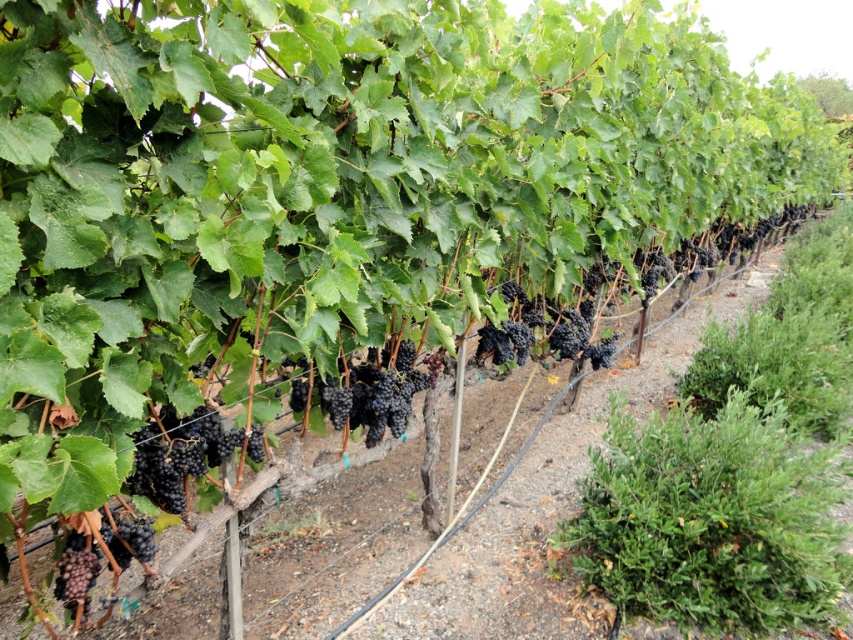
Question: Does shiny purple grapes at center lie behind shiny dark purple grapes at center?

Choices:
 (A) yes
 (B) no

Answer: (B)

Question: Can you confirm if shiny purple grapes at center is wider than black matte grapes at lower left?

Choices:
 (A) yes
 (B) no

Answer: (A)

Question: Can you confirm if shiny purple grapes at center is smaller than shiny dark purple grapes at center?

Choices:
 (A) no
 (B) yes

Answer: (B)

Question: Which point is farther from the camera taking this photo?

Choices:
 (A) (262, 429)
 (B) (289, 404)

Answer: (B)

Question: Which is farther from the black matte grapes at lower left?

Choices:
 (A) shiny purple grapes at center
 (B) shiny dark purple grapes at center

Answer: (B)

Question: Among these points, which one is farthest from the camera?

Choices:
 (A) (432, 365)
 (B) (91, 557)
 (C) (189, 468)

Answer: (A)